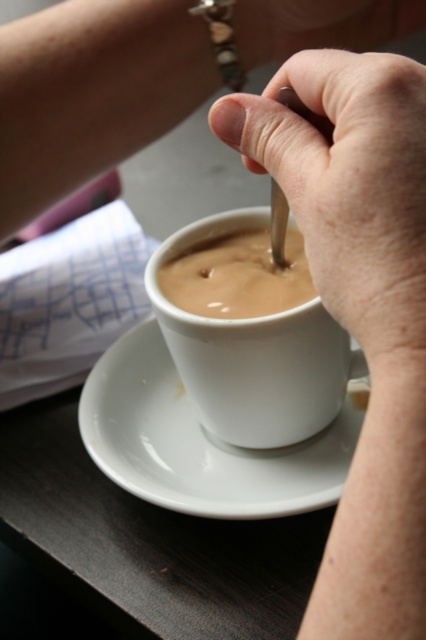
You are a barista preparing a latte. You have a matte silver spoon at upper center that you need to place into a 8 inch long cup. Can the spoon fit inside the cup?

The matte silver spoon at upper center is 7.95 inches long, which is slightly shorter than the 8 inch cup. Therefore, the spoon can fit inside the cup.

You are a photographer trying to capture a detailed closeup of the white glossy saucer at center. Based on the scene description, can you determine if the saucer is within the optimal focus range of your camera lens, which has a minimum focus distance of 14 inches?

The white glossy saucer at center is 13.83 inches away from the camera, which is just below the camera lens minimum focus distance of 14 inches. Therefore, the saucer is slightly too close to be in focus.

You are a barista preparing a latte. You have a matte silver spoon at upper center and a white matte cup at center. Which object is shorter in height?

The matte silver spoon at upper center is shorter than the white matte cup at center.